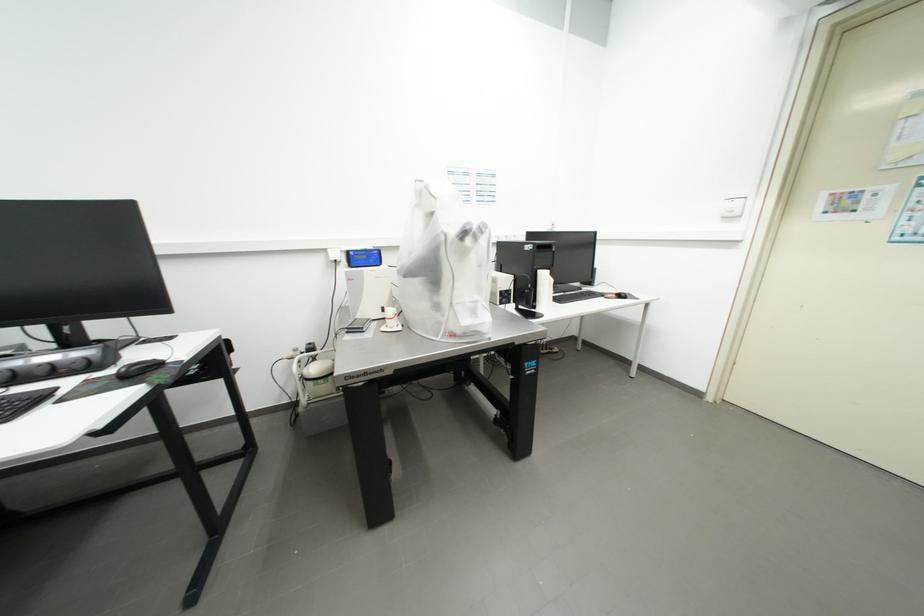
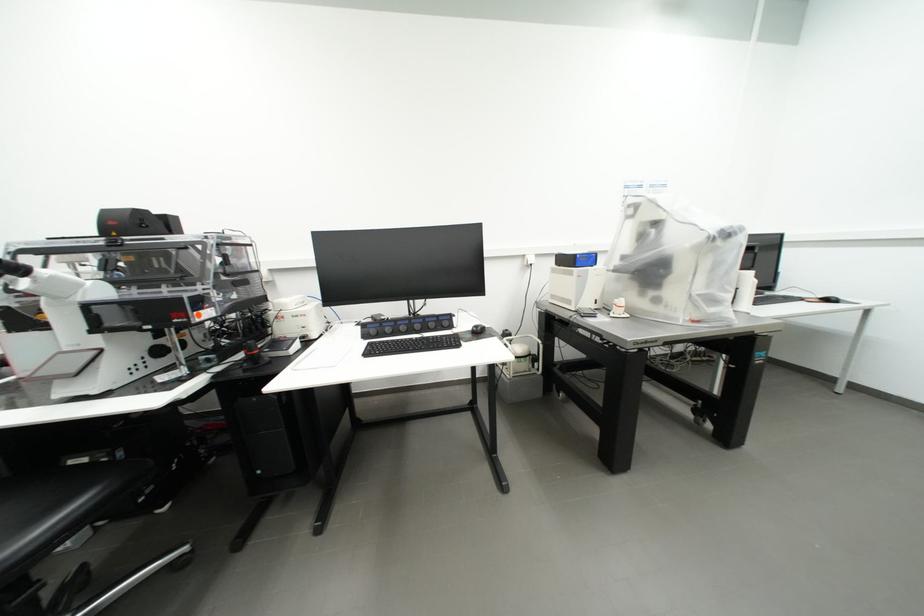
Question: The camera is either moving clockwise (left) or counter-clockwise (right) around the object. The first image is from the beginning of the video and the second image is from the end. Is the camera moving left or right when shooting the video?

Choices:
 (A) Left
 (B) Right

Answer: (B)